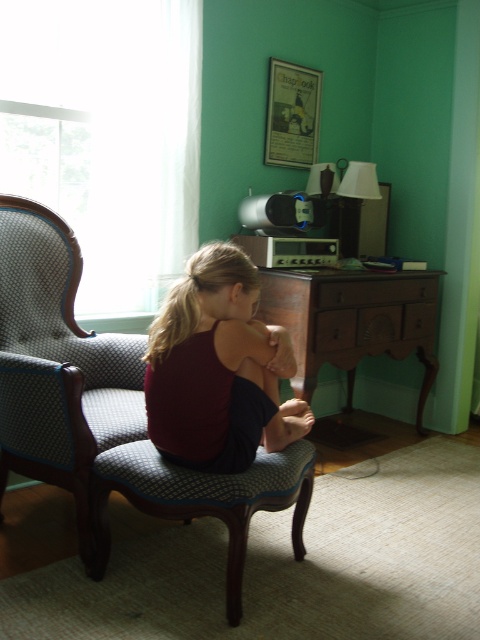
Is matte red tank top at center above blonde hair at upper center?

Incorrect, matte red tank top at center is not positioned above blonde hair at upper center.

Can you confirm if matte red tank top at center is taller than blonde hair at upper center?

Yes, matte red tank top at center is taller than blonde hair at upper center.

Is point (193, 419) positioned after point (153, 330)?

No, (193, 419) is in front of (153, 330).

This screenshot has width=480, height=640. Identify the location of matte red tank top at center. (214, 369).

In the scene shown: Does matte red tank top at center appear on the left side of patterned fabric stool at center?

No, matte red tank top at center is not to the left of patterned fabric stool at center.

Is point (286, 416) positioned after point (236, 618)?

Yes.

Where is `matte red tank top at center`? This screenshot has width=480, height=640. matte red tank top at center is located at coordinates (214, 369).

Does patterned fabric stool at center have a smaller size compared to blonde hair at upper center?

No.

Does patterned fabric stool at center come behind blonde hair at upper center?

That is False.

Does point (311, 449) come closer to viewer compared to point (167, 355)?

No, (311, 449) is further to viewer.

Where is `patterned fabric stool at center`? patterned fabric stool at center is located at coordinates (203, 499).